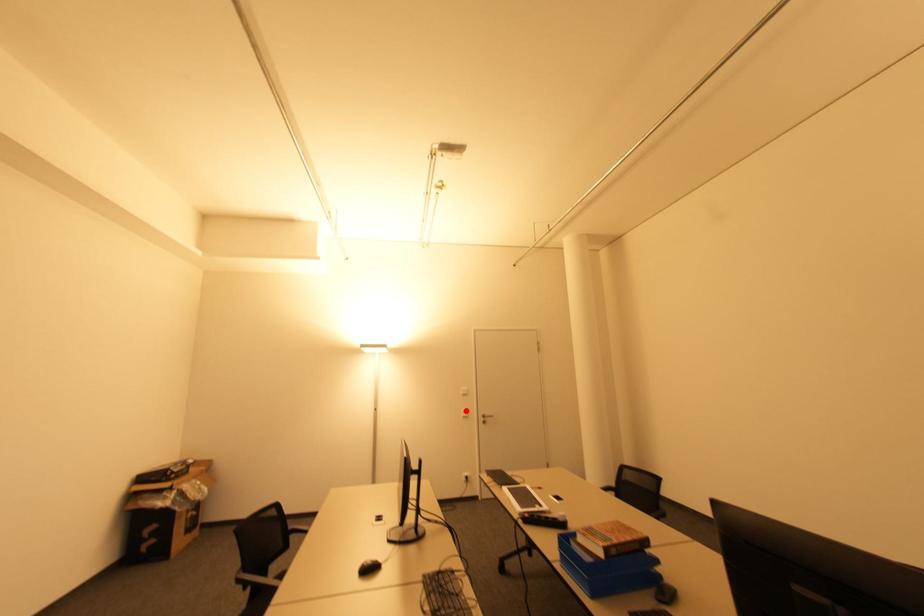
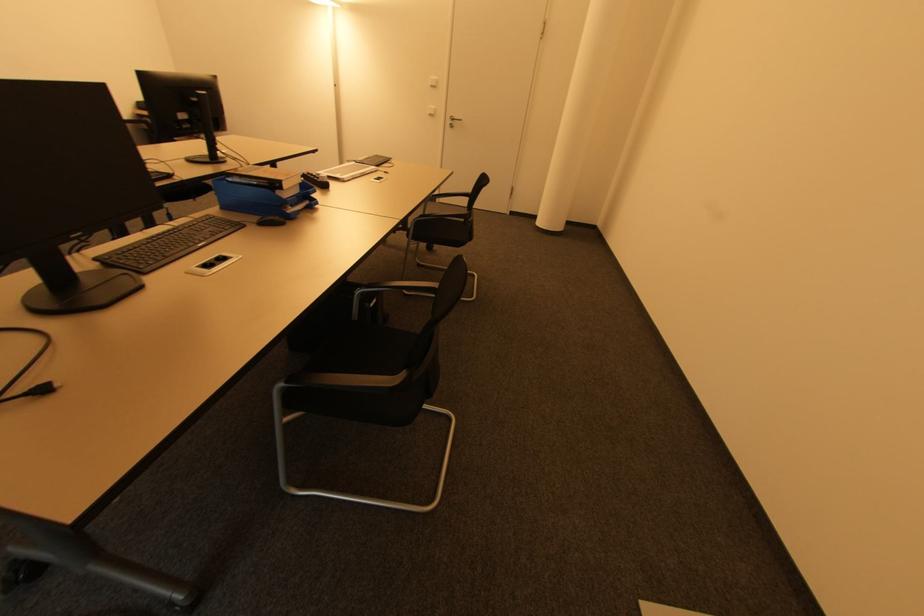
Question: I am providing you with two images of the same scene from different viewpoints. A red point is shown in image1. For the corresponding object point in image2, is it positioned nearer or farther from the camera?

Choices:
 (A) Nearer
 (B) Farther

Answer: (A)